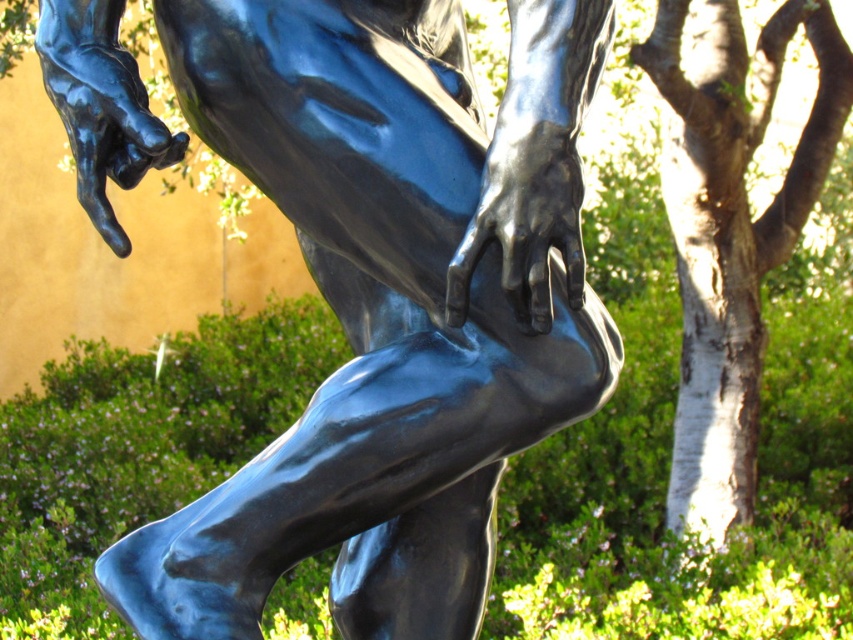
Question: Which point is farther to the camera?

Choices:
 (A) (102, 100)
 (B) (726, 336)

Answer: (B)

Question: Considering the relative positions of glossy bronze statue at center and white bark tree at right in the image provided, where is glossy bronze statue at center located with respect to white bark tree at right?

Choices:
 (A) right
 (B) left

Answer: (B)

Question: Does glossy bronze statue at center have a lesser width compared to white bark tree at right?

Choices:
 (A) yes
 (B) no

Answer: (A)

Question: Is the position of glossy bronze statue at center more distant than that of white bark tree at right?

Choices:
 (A) no
 (B) yes

Answer: (A)